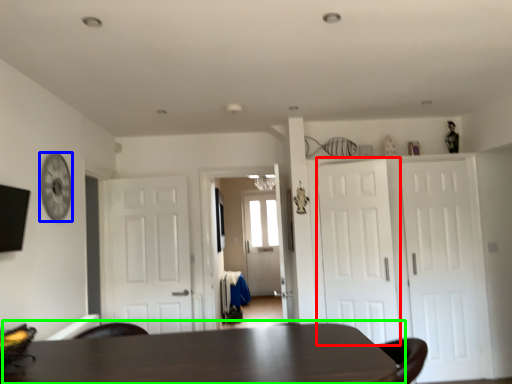
Question: Which object is the closest to the door (highlighted by a red box)? Choose among these: clock (highlighted by a blue box) or table (highlighted by a green box).

Choices:
 (A) clock
 (B) table

Answer: (B)